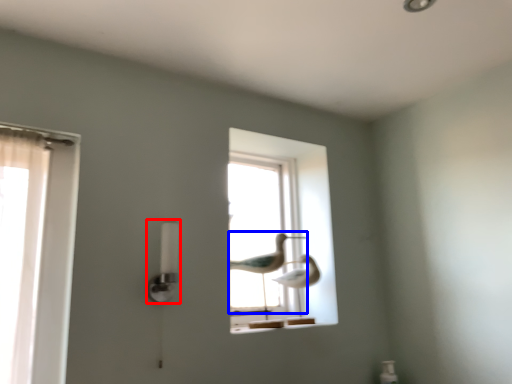
Question: Which object appears farthest to the camera in this image, lamp (highlighted by a red box) or bird (highlighted by a blue box)?

Choices:
 (A) lamp
 (B) bird

Answer: (B)